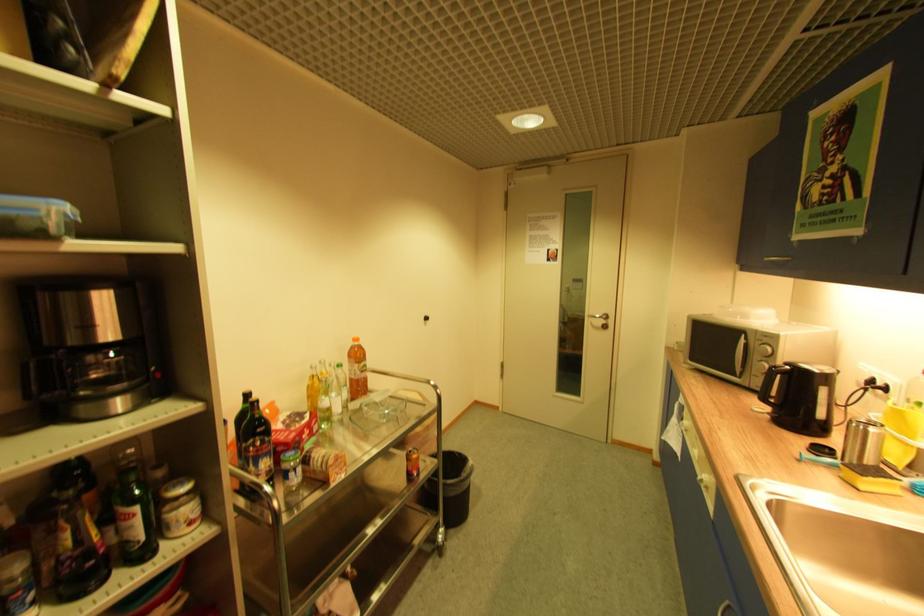
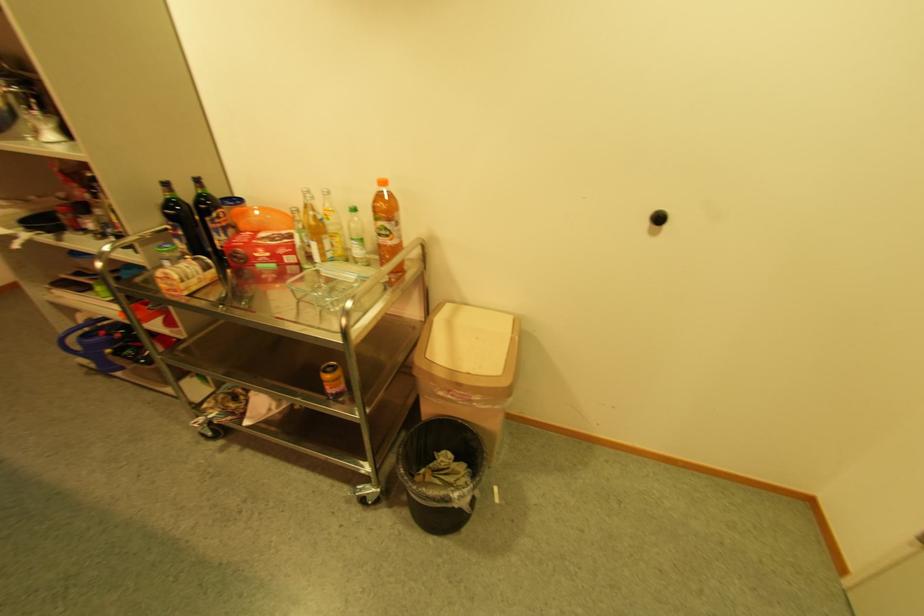
In the second image, find the point that corresponds to point (320, 440) in the first image.

(278, 267)